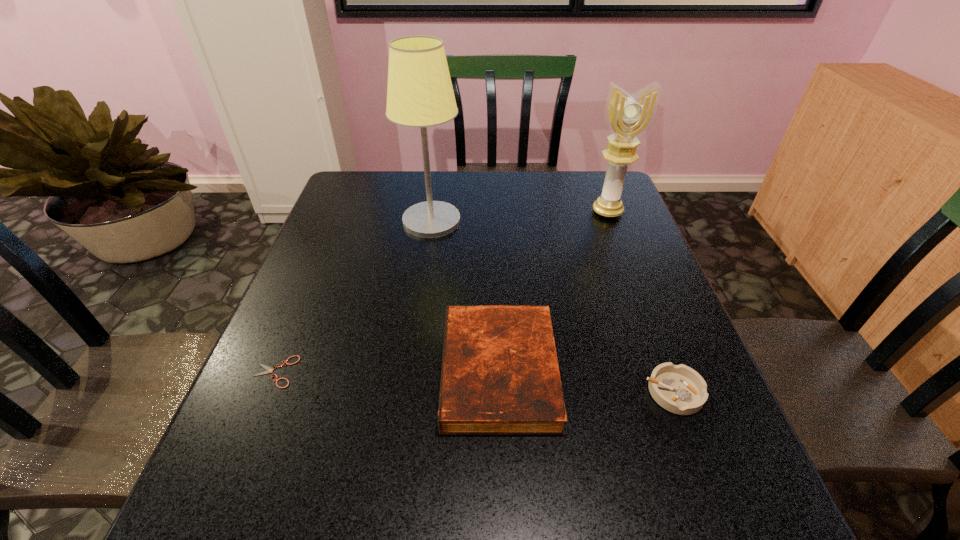
What are the coordinates of `vacant space at the near edge` in the screenshot? It's located at (432, 503).

The width and height of the screenshot is (960, 540). Identify the location of free space at the left edge of the desktop. (279, 356).

At what (x,y) coordinates should I click in order to perform the action: click on vacant space at the right edge of the desktop. Please return your answer as a coordinate pair (x, y). This screenshot has width=960, height=540. Looking at the image, I should click on (639, 295).

Identify the location of vacant space at the near right corner of the desktop. (681, 509).

Find the location of `unoccupied area between the tallest object and the ashtray`. unoccupied area between the tallest object and the ashtray is located at coordinates (553, 307).

You are a GUI agent. You are given a task and a screenshot of the screen. Output one action in this format:
    pyautogui.click(x=<x>, y=<y>)
    Task: Click on the empty space that is in between the fourth shortest object and the shears
    The width and height of the screenshot is (960, 540).
    Given the screenshot: What is the action you would take?
    pyautogui.click(x=442, y=292)

Find the location of a particular element. Image resolution: width=960 pixels, height=540 pixels. free space between the table lamp and the award is located at coordinates (519, 216).

Where is `free area in between the Bible and the leftmost object`? This screenshot has height=540, width=960. free area in between the Bible and the leftmost object is located at coordinates (387, 372).

You are a GUI agent. You are given a task and a screenshot of the screen. Output one action in this format:
    pyautogui.click(x=<x>, y=<y>)
    Task: Click on the vacant point located between the third shortest object and the award
    The height and width of the screenshot is (540, 960).
    Given the screenshot: What is the action you would take?
    pyautogui.click(x=553, y=292)

Find the location of `vacant area that lies between the second shortest object and the award`. vacant area that lies between the second shortest object and the award is located at coordinates (640, 302).